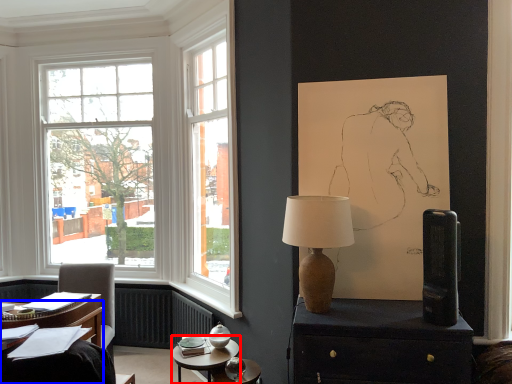
Question: Which object is further to the camera taking this photo, table (highlighted by a red box) or desk (highlighted by a blue box)?

Choices:
 (A) table
 (B) desk

Answer: (A)